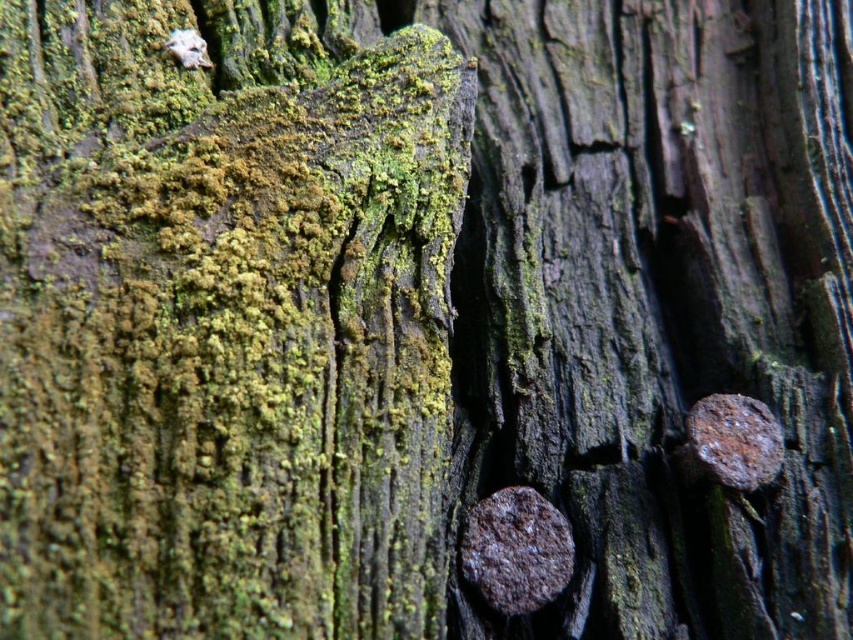
You are a carpenter examining the weathered wooden surface. You notice the rusty metallic nail at lower right. Can you determine its exact position on the surface using the coordinate system provided?

The rusty metallic nail at lower right is located at point (515, 550).

Consider the image. You are a carpenter assessing the stability of the wooden surface. You notice two rusty nails embedded in the wood. Which nail has a wider head? The rusty metallic nail at lower right or the rusty metal nail at right?

The rusty metallic nail at lower right has a wider head than the rusty metal nail at right.